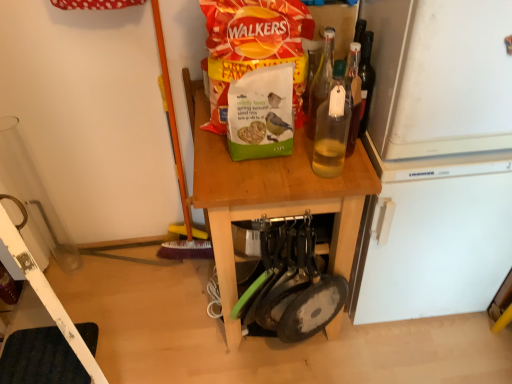
The width and height of the screenshot is (512, 384). What are the coordinates of `vacant region to the right of white plastic ladder at lower left` in the screenshot? It's located at [158, 337].